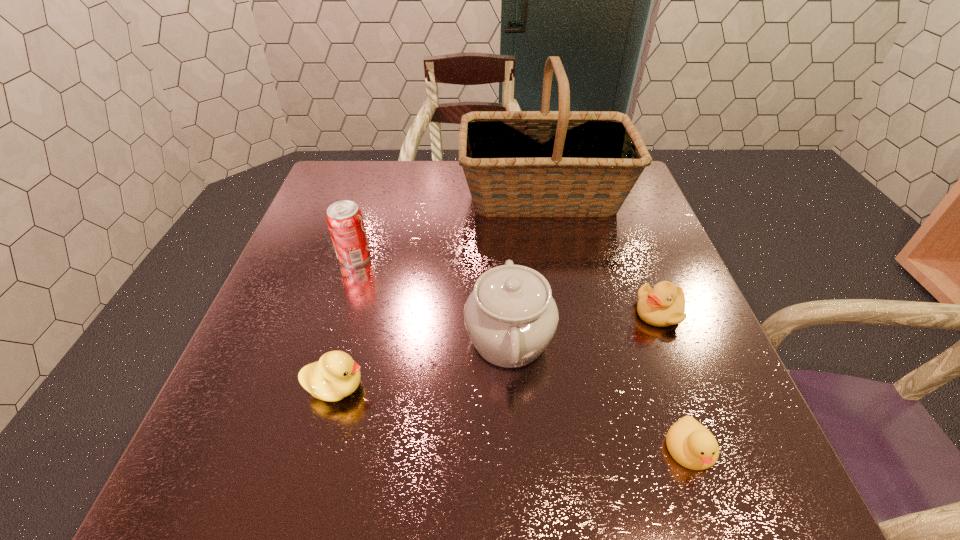
Locate an element on the screen. The height and width of the screenshot is (540, 960). free space between the second farthest object and the second farthest duckling is located at coordinates (346, 322).

I want to click on free spot between the chinaware and the fifth nearest object, so click(432, 298).

Find the location of `vacant area that lies between the second farthest duckling and the soda can`. vacant area that lies between the second farthest duckling and the soda can is located at coordinates (346, 322).

Identify the location of empty space between the third tallest object and the second nearest duckling. (346, 322).

I want to click on free space between the chinaware and the leftmost duckling, so click(x=422, y=363).

Identify which object is the fourth nearest to the second farthest duckling. Please provide its 2D coordinates. Your answer should be formatted as a tuple, i.e. [(x, y)], where the tuple contains the x and y coordinates of a point satisfying the conditions above.

[(692, 445)]

Identify which object is the nearest to the chinaware. Please provide its 2D coordinates. Your answer should be formatted as a tuple, i.e. [(x, y)], where the tuple contains the x and y coordinates of a point satisfying the conditions above.

[(692, 445)]

This screenshot has height=540, width=960. What are the coordinates of `the closest duckling relative to the farthest duckling` in the screenshot? It's located at (692, 445).

Identify which duckling is the nearest to the farthest duckling. Please provide its 2D coordinates. Your answer should be formatted as a tuple, i.e. [(x, y)], where the tuple contains the x and y coordinates of a point satisfying the conditions above.

[(692, 445)]

Where is `free location that satisfies the following two spatial constraints: 1. on the front-facing side of the farthest duckling; 2. on the face of the nearest duckling`? The height and width of the screenshot is (540, 960). free location that satisfies the following two spatial constraints: 1. on the front-facing side of the farthest duckling; 2. on the face of the nearest duckling is located at coordinates (712, 449).